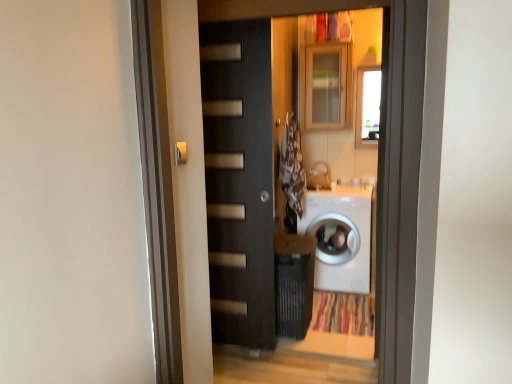
Question: Is wooden cabinet at upper center further to the viewer compared to matte black door at center?

Choices:
 (A) no
 (B) yes

Answer: (B)

Question: Is wooden cabinet at upper center smaller than matte black door at center?

Choices:
 (A) no
 (B) yes

Answer: (B)

Question: From the image's perspective, is wooden cabinet at upper center under matte black door at center?

Choices:
 (A) yes
 (B) no

Answer: (B)

Question: From a real-world perspective, is wooden cabinet at upper center physically above matte black door at center?

Choices:
 (A) yes
 (B) no

Answer: (A)

Question: Would you say wooden cabinet at upper center contains matte black door at center?

Choices:
 (A) yes
 (B) no

Answer: (B)

Question: Is there a large distance between wooden cabinet at upper center and matte black door at center?

Choices:
 (A) yes
 (B) no

Answer: (A)

Question: Is brown fabric laundry at center at the right side of metallic silver door handle at upper center?

Choices:
 (A) yes
 (B) no

Answer: (A)

Question: Considering the relative sizes of brown fabric laundry at center and metallic silver door handle at upper center in the image provided, is brown fabric laundry at center bigger than metallic silver door handle at upper center?

Choices:
 (A) yes
 (B) no

Answer: (A)

Question: Is brown fabric laundry at center positioned with its back to metallic silver door handle at upper center?

Choices:
 (A) yes
 (B) no

Answer: (B)

Question: From a real-world perspective, is brown fabric laundry at center located higher than metallic silver door handle at upper center?

Choices:
 (A) yes
 (B) no

Answer: (B)

Question: Can you confirm if brown fabric laundry at center is positioned to the left of metallic silver door handle at upper center?

Choices:
 (A) no
 (B) yes

Answer: (A)

Question: Is brown fabric laundry at center positioned far away from metallic silver door handle at upper center?

Choices:
 (A) no
 (B) yes

Answer: (B)

Question: Does metallic silver door handle at upper center turn towards wooden cabinet at upper center?

Choices:
 (A) no
 (B) yes

Answer: (A)